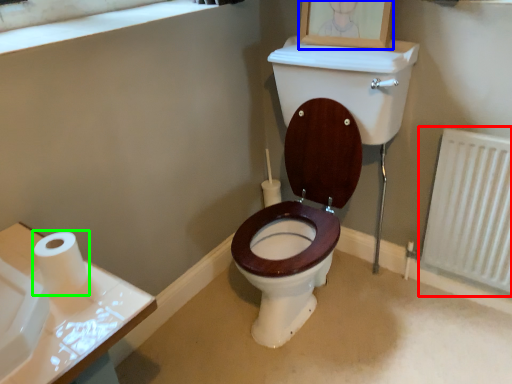
Question: Which object is positioned farthest from radiator (highlighted by a red box)? Select from picture frame (highlighted by a blue box) and toilet paper (highlighted by a green box).

Choices:
 (A) picture frame
 (B) toilet paper

Answer: (B)